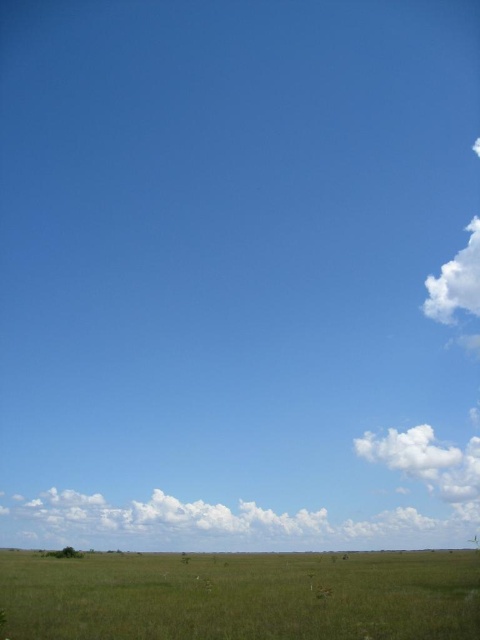
Question: From the image, what is the correct spatial relationship of green grassy field at lower center in relation to white fluffy cloud at upper right?

Choices:
 (A) below
 (B) above

Answer: (A)

Question: Is white fluffy cloud at lower center to the left of white fluffy cloud at upper right from the viewer's perspective?

Choices:
 (A) no
 (B) yes

Answer: (B)

Question: Which of these objects is positioned farthest from the green grassy field at lower center?

Choices:
 (A) white fluffy cloud at lower center
 (B) white fluffy cloud at upper right

Answer: (B)

Question: Which of the following is the farthest from the observer?

Choices:
 (A) (275, 540)
 (B) (456, 605)

Answer: (A)

Question: Among these objects, which one is farthest from the camera?

Choices:
 (A) white fluffy cloud at lower center
 (B) green grassy field at lower center

Answer: (A)

Question: Is green grassy field at lower center closer to camera compared to white fluffy cloud at lower center?

Choices:
 (A) no
 (B) yes

Answer: (B)